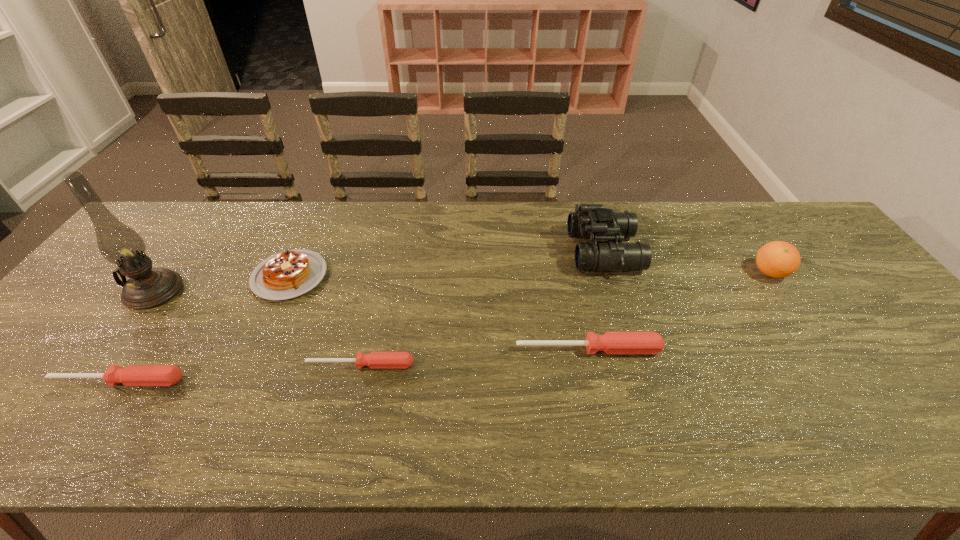
Image resolution: width=960 pixels, height=540 pixels. Identify the location of the leftmost screwdriver. (132, 375).

At what (x,y) coordinates should I click in order to perform the action: click on the nearest screwdriver. Please return your answer as a coordinate pair (x, y). The height and width of the screenshot is (540, 960). Looking at the image, I should click on (132, 375).

Find the location of a particular element. the second nearest object is located at coordinates (375, 360).

You are a GUI agent. You are given a task and a screenshot of the screen. Output one action in this format:
    pyautogui.click(x=<x>, y=<y>)
    Task: Click on the second nearest screwdriver
    This screenshot has width=960, height=540.
    Given the screenshot: What is the action you would take?
    pyautogui.click(x=375, y=360)

Identify the location of the third nearest object. The height and width of the screenshot is (540, 960). (612, 343).

What are the coordinates of `the farthest screwdriver` in the screenshot? It's located at (612, 343).

Locate an element on the screen. The height and width of the screenshot is (540, 960). the sixth shortest object is located at coordinates (590, 221).

You are a GUI agent. You are given a task and a screenshot of the screen. Output one action in this format:
    pyautogui.click(x=<x>, y=<y>)
    Task: Click on the orange
    
    Given the screenshot: What is the action you would take?
    pyautogui.click(x=777, y=259)

I want to click on the fifth shortest object, so click(777, 259).

Locate an element on the screen. the tallest object is located at coordinates (147, 287).